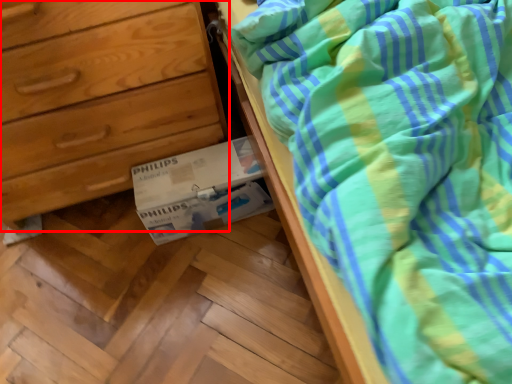
Question: From the image, what is the correct spatial relationship of chest of drawers (annotated by the red box) in relation to cardboard box?

Choices:
 (A) left
 (B) right

Answer: (A)